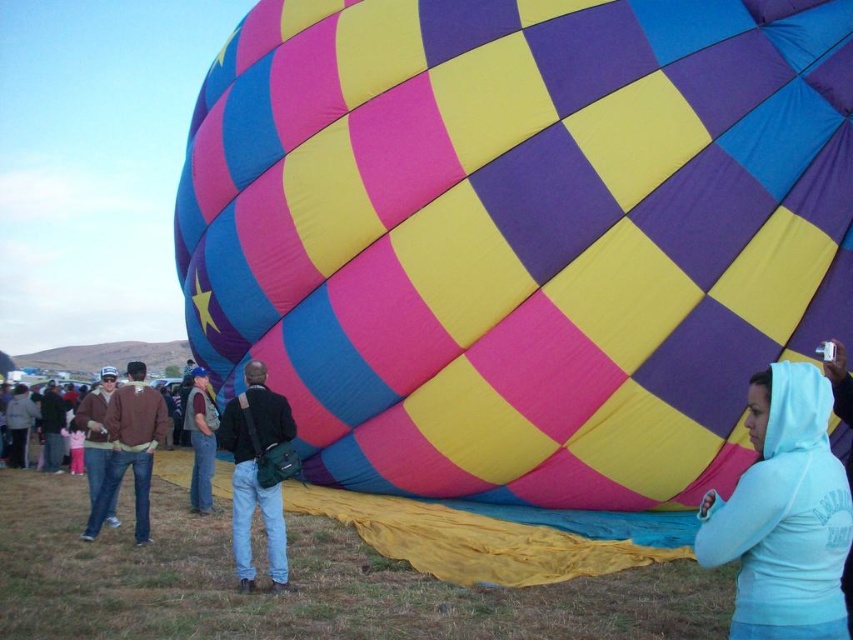
Consider the image. Which is below, light blue hoodie at lower right or denim jacket at center?

denim jacket at center is lower down.

The image size is (853, 640). What do you see at coordinates (784, 513) in the screenshot? I see `light blue hoodie at lower right` at bounding box center [784, 513].

Does point (830, 460) come behind point (192, 481)?

No, (830, 460) is in front of (192, 481).

Where is `light blue hoodie at lower right`? The image size is (853, 640). light blue hoodie at lower right is located at coordinates (784, 513).

Is checkered fabric balloon at center closer to the viewer compared to light blue hoodie at lower right?

No, checkered fabric balloon at center is behind light blue hoodie at lower right.

Between checkered fabric balloon at center and light blue hoodie at lower right, which one is positioned lower?

light blue hoodie at lower right is below.

The image size is (853, 640). Find the location of `checkered fabric balloon at center`. checkered fabric balloon at center is located at coordinates click(x=520, y=234).

I want to click on checkered fabric balloon at center, so click(x=520, y=234).

Which is more to the right, checkered fabric balloon at center or dark blue leather jacket at center?

From the viewer's perspective, checkered fabric balloon at center appears more on the right side.

Which is in front, point (619, 221) or point (244, 500)?

Point (244, 500) is more forward.

I want to click on checkered fabric balloon at center, so click(x=520, y=234).